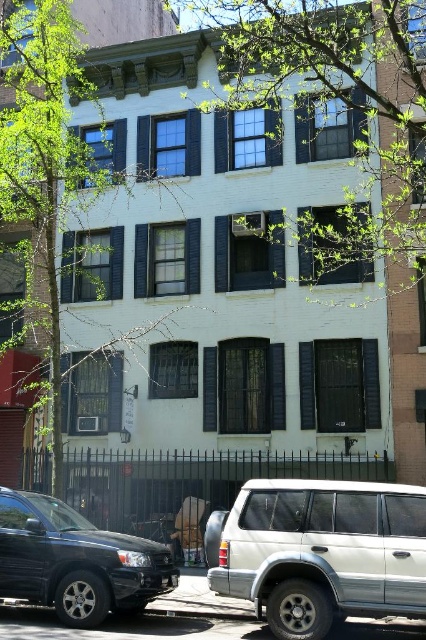
Question: Which object is positioned farthest from the green leafy tree at upper left?

Choices:
 (A) green leafy tree at center
 (B) shiny black suv at lower left

Answer: (B)

Question: Is green leafy tree at center above metallic silver minivan at center?

Choices:
 (A) yes
 (B) no

Answer: (A)

Question: Can you confirm if metallic silver minivan at center is positioned to the right of green leafy tree at upper left?

Choices:
 (A) no
 (B) yes

Answer: (B)

Question: Which point is closer to the camera?

Choices:
 (A) shiny black suv at lower left
 (B) metallic silver minivan at center
 (C) green leafy tree at center

Answer: (B)

Question: Is green leafy tree at center positioned before shiny black suv at lower left?

Choices:
 (A) yes
 (B) no

Answer: (B)

Question: Which of the following is the farthest from the observer?

Choices:
 (A) shiny black suv at lower left
 (B) metallic silver minivan at center
 (C) green leafy tree at upper left

Answer: (C)